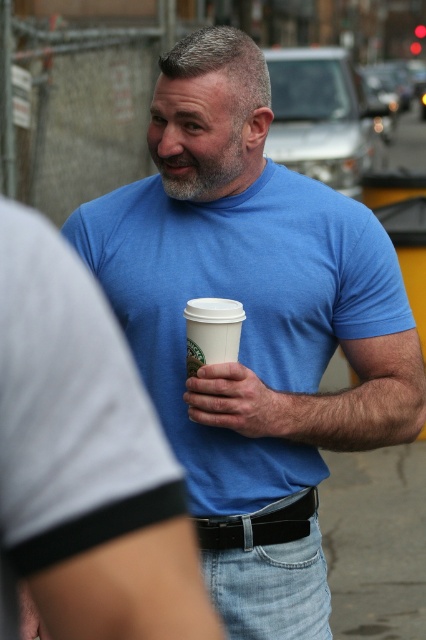
Between point (219, 186) and point (186, 326), which one is positioned in front?

Point (186, 326)

Between point (181, 138) and point (238, 328), which one is positioned in front?

Positioned in front is point (238, 328).

Find the location of a particular element. gray matte beard at center is located at coordinates (198, 157).

Who is shorter, jeans at center or gray matte beard at center?

With less height is gray matte beard at center.

Describe the element at coordinates (267, 570) in the screenshot. Image resolution: width=426 pixels, height=640 pixels. I see `jeans at center` at that location.

The width and height of the screenshot is (426, 640). Find the location of `jeans at center`. jeans at center is located at coordinates (267, 570).

Is jeans at center above smooth skin hand at center?

No, jeans at center is not above smooth skin hand at center.

Can you confirm if jeans at center is shorter than smooth skin hand at center?

Incorrect, jeans at center's height does not fall short of smooth skin hand at center's.

Identify the location of jeans at center. The height and width of the screenshot is (640, 426). (267, 570).

Locate an element on the screen. jeans at center is located at coordinates (267, 570).